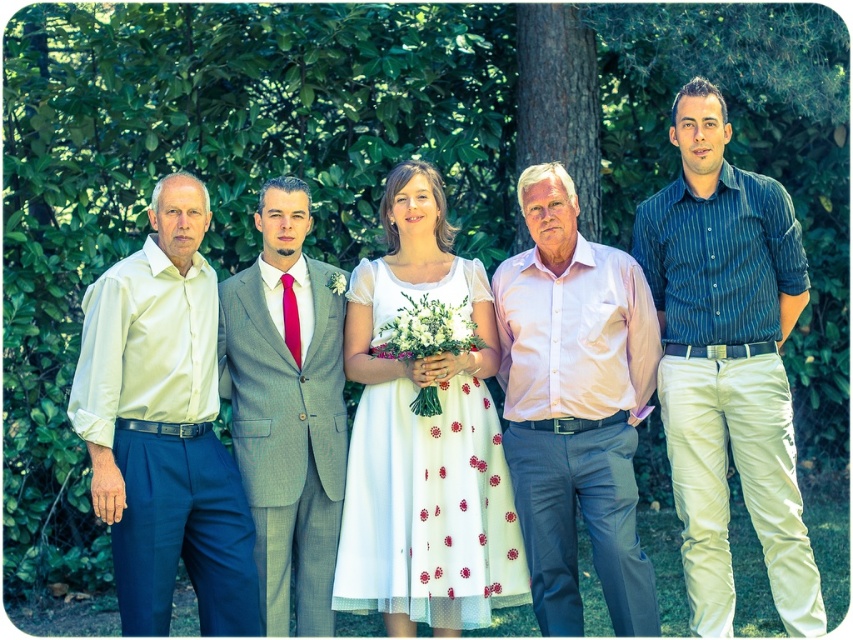
Question: Among these objects, which one is farthest from the camera?

Choices:
 (A) blue striped shirt at center
 (B) white textured fabric dress at center
 (C) pink satin shirt at center

Answer: (B)

Question: Does blue striped shirt at center lie in front of white textured fabric dress at center?

Choices:
 (A) yes
 (B) no

Answer: (A)

Question: Is light beige satin shirt at left wider than gray wool suit at center?

Choices:
 (A) no
 (B) yes

Answer: (B)

Question: Is pink satin shirt at center above white textured fabric dress at center?

Choices:
 (A) yes
 (B) no

Answer: (A)

Question: Which point appears closest to the camera in this image?

Choices:
 (A) (550, 625)
 (B) (117, 592)
 (C) (474, 416)

Answer: (B)

Question: Among these points, which one is farthest from the camera?

Choices:
 (A) (703, 401)
 (B) (286, 189)

Answer: (B)